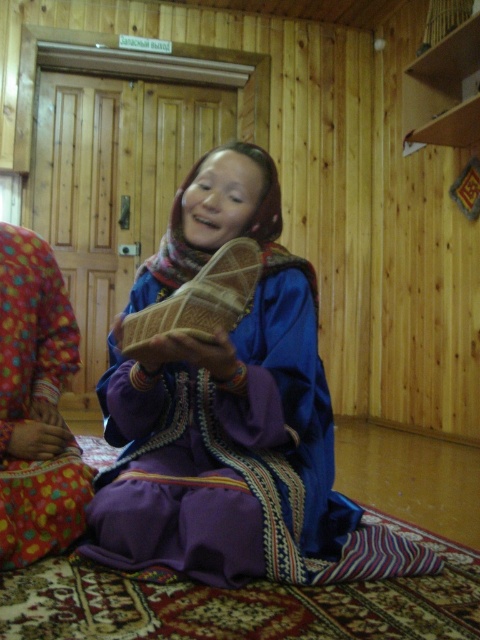
Question: Considering the relative positions of matte brown sandal at center and purple satin dress at center in the image provided, where is matte brown sandal at center located with respect to purple satin dress at center?

Choices:
 (A) right
 (B) left

Answer: (A)

Question: Is matte brown sandal at center above purple satin dress at center?

Choices:
 (A) yes
 (B) no

Answer: (A)

Question: Does matte brown sandal at center appear over purple satin dress at center?

Choices:
 (A) yes
 (B) no

Answer: (A)

Question: Among these points, which one is nearest to the camera?

Choices:
 (A) (45, 252)
 (B) (330, 472)

Answer: (B)

Question: Which of the following is the farthest from the observer?

Choices:
 (A) purple satin dress at center
 (B) matte brown sandal at center

Answer: (A)